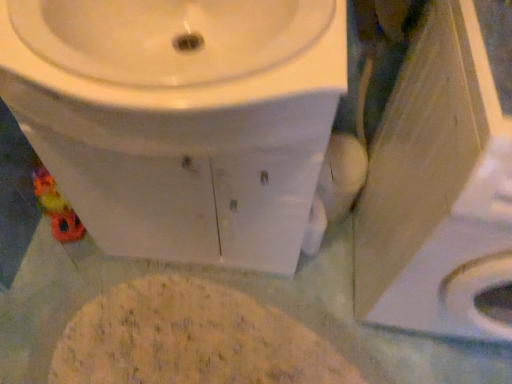
Where is `vacant area situated below yellowish powder at center (from a real-world perspective)`? vacant area situated below yellowish powder at center (from a real-world perspective) is located at coordinates (223, 335).